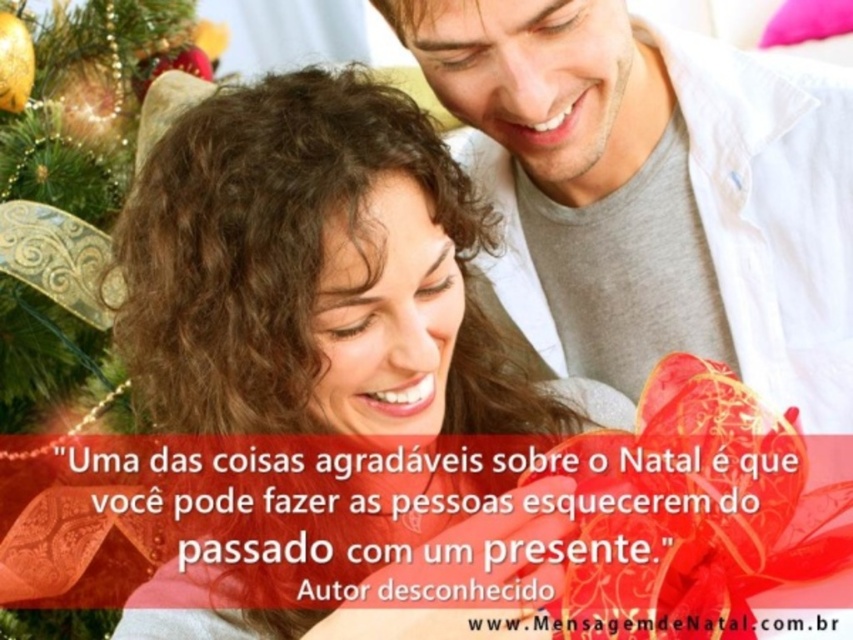
Question: Does curly hair at center have a greater width compared to shiny red ribbon at upper left?

Choices:
 (A) no
 (B) yes

Answer: (B)

Question: Estimate the real-world distances between objects in this image. Which object is closer to the shiny red ribbon at upper left?

Choices:
 (A) curly hair at center
 (B) white cotton shirt at upper right

Answer: (A)

Question: Estimate the real-world distances between objects in this image. Which object is closer to the curly hair at center?

Choices:
 (A) shiny red ribbon at upper left
 (B) white cotton shirt at upper right

Answer: (B)

Question: Which object is farther from the camera taking this photo?

Choices:
 (A) shiny red ribbon at upper left
 (B) white cotton shirt at upper right

Answer: (A)

Question: Can you confirm if white cotton shirt at upper right is thinner than shiny red ribbon at upper left?

Choices:
 (A) yes
 (B) no

Answer: (B)

Question: Can you confirm if white cotton shirt at upper right is smaller than curly hair at center?

Choices:
 (A) no
 (B) yes

Answer: (B)